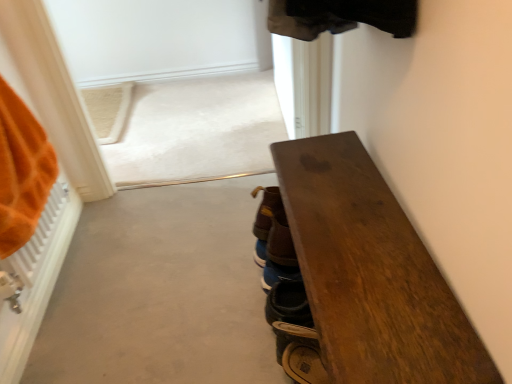
This screenshot has height=384, width=512. Identify the location of dark wood bench at right. (371, 272).

Measure the distance between dark wood bench at right and camera.

dark wood bench at right is 24.29 inches away from camera.

The height and width of the screenshot is (384, 512). What do you see at coordinates (274, 240) in the screenshot? I see `brown leather shoes at center, which is the second footwear in front-to-back order` at bounding box center [274, 240].

Image resolution: width=512 pixels, height=384 pixels. What are the coordinates of `dark wood bench at right` in the screenshot? It's located at (371, 272).

Who is taller, leather brown shoe at lower center, positioned as the first footwear in front-to-back order, or brown leather shoes at center, the second footwear viewed from the back?

brown leather shoes at center, the second footwear viewed from the back.

Is leather brown shoe at lower center, the third footwear positioned from the back, positioned far away from brown leather shoes at center, the second footwear viewed from the back?

Actually, leather brown shoe at lower center, the third footwear positioned from the back, and brown leather shoes at center, the second footwear viewed from the back, are a little close together.

Is leather brown shoe at lower center, the third footwear positioned from the back, outside of brown leather shoes at center, the second footwear viewed from the back?

Absolutely, leather brown shoe at lower center, the third footwear positioned from the back, is external to brown leather shoes at center, the second footwear viewed from the back.

Can leather brown shoe at lower center, positioned as the first footwear in front-to-back order, be found inside brown suede shoes at center, placed as the 1th footwear when sorted from back to front?

No, leather brown shoe at lower center, positioned as the first footwear in front-to-back order, is not surrounded by brown suede shoes at center, placed as the 1th footwear when sorted from back to front.

How far apart are brown suede shoes at center, the 3th footwear when ordered from front to back, and leather brown shoe at lower center, the third footwear positioned from the back?

brown suede shoes at center, the 3th footwear when ordered from front to back, and leather brown shoe at lower center, the third footwear positioned from the back, are 25.57 centimeters apart.

From the image's perspective, which one is positioned higher, brown suede shoes at center, the 3th footwear when ordered from front to back, or leather brown shoe at lower center, the third footwear positioned from the back?

brown suede shoes at center, the 3th footwear when ordered from front to back, is shown above in the image.

Looking at this image, considering the relative sizes of brown suede shoes at center, placed as the 1th footwear when sorted from back to front, and leather brown shoe at lower center, positioned as the first footwear in front-to-back order, in the image provided, is brown suede shoes at center, placed as the 1th footwear when sorted from back to front, bigger than leather brown shoe at lower center, positioned as the first footwear in front-to-back order,?

Yes.

Measure the distance between leather brown shoe at lower center, the third footwear positioned from the back, and brown suede shoes at center, the 3th footwear when ordered from front to back.

leather brown shoe at lower center, the third footwear positioned from the back, and brown suede shoes at center, the 3th footwear when ordered from front to back, are 10.07 inches apart.

Is leather brown shoe at lower center, positioned as the first footwear in front-to-back order, positioned far away from brown suede shoes at center, the 3th footwear when ordered from front to back?

No, leather brown shoe at lower center, positioned as the first footwear in front-to-back order, is in close proximity to brown suede shoes at center, the 3th footwear when ordered from front to back.

Which object is thinner, leather brown shoe at lower center, positioned as the first footwear in front-to-back order, or brown suede shoes at center, placed as the 1th footwear when sorted from back to front?

brown suede shoes at center, placed as the 1th footwear when sorted from back to front.

Considering the sizes of leather brown shoe at lower center, positioned as the first footwear in front-to-back order, and brown suede shoes at center, placed as the 1th footwear when sorted from back to front, in the image, is leather brown shoe at lower center, positioned as the first footwear in front-to-back order, bigger or smaller than brown suede shoes at center, placed as the 1th footwear when sorted from back to front,?

Clearly, leather brown shoe at lower center, positioned as the first footwear in front-to-back order, is smaller in size than brown suede shoes at center, placed as the 1th footwear when sorted from back to front.

Which is less distant, (x=271, y=196) or (x=260, y=214)?

Clearly, point (x=271, y=196) is closer to the camera than point (x=260, y=214).

Is brown suede shoes at center, placed as the 1th footwear when sorted from back to front, next to brown leather shoes at center, the second footwear viewed from the back, and touching it?

Yes, brown suede shoes at center, placed as the 1th footwear when sorted from back to front, is in contact with brown leather shoes at center, the second footwear viewed from the back.

Can you confirm if brown suede shoes at center, the 3th footwear when ordered from front to back, is shorter than brown leather shoes at center, which is the second footwear in front-to-back order?

Yes.

Is leather brown shoe at lower center, the third footwear positioned from the back, turned away from dark wood bench at right?

Yes, leather brown shoe at lower center, the third footwear positioned from the back,'s orientation is away from dark wood bench at right.

From a real-world perspective, which object rests below the other?

dark wood bench at right.

Consider the image. Who is taller, leather brown shoe at lower center, the third footwear positioned from the back, or dark wood bench at right?

dark wood bench at right.

Is point (288, 334) less distant than point (285, 168)?

Yes, it is in front of point (285, 168).

From a real-world perspective, is dark wood bench at right positioned over brown suede shoes at center, the 3th footwear when ordered from front to back, based on gravity?

No, from a real-world perspective, dark wood bench at right is not over brown suede shoes at center, the 3th footwear when ordered from front to back

Is dark wood bench at right at the right side of brown suede shoes at center, placed as the 1th footwear when sorted from back to front?

Yes, dark wood bench at right is to the right of brown suede shoes at center, placed as the 1th footwear when sorted from back to front.

Is there a large distance between dark wood bench at right and brown suede shoes at center, placed as the 1th footwear when sorted from back to front?

dark wood bench at right is near brown suede shoes at center, placed as the 1th footwear when sorted from back to front, not far away.

Is dark wood bench at right oriented away from brown suede shoes at center, placed as the 1th footwear when sorted from back to front?

No, dark wood bench at right's orientation is not away from brown suede shoes at center, placed as the 1th footwear when sorted from back to front.

Can you confirm if brown suede shoes at center, placed as the 1th footwear when sorted from back to front, is shorter than dark wood bench at right?

Yes.

How much distance is there between brown suede shoes at center, placed as the 1th footwear when sorted from back to front, and dark wood bench at right?

12.44 inches.

From a real-world perspective, which object rests below the other?

dark wood bench at right.

At what (x,y) coordinates should I click in order to perform the action: click on the 1st footwear to the left when counting from the leather brown shoe at lower center, the third footwear positioned from the back. Please return your answer as a coordinate pair (x, y). The image size is (512, 384). Looking at the image, I should click on (274, 240).

Identify the location of footwear that is under the brown suede shoes at center, placed as the 1th footwear when sorted from back to front (from a real-world perspective). (295, 333).

Considering their positions, is brown leather shoes at center, which is the second footwear in front-to-back order, positioned closer to dark wood bench at right than leather brown shoe at lower center, the third footwear positioned from the back?

leather brown shoe at lower center, the third footwear positioned from the back.

Considering their positions, is brown suede shoes at center, placed as the 1th footwear when sorted from back to front, positioned further to dark wood bench at right than brown leather shoes at center, the second footwear viewed from the back?

brown suede shoes at center, placed as the 1th footwear when sorted from back to front.

When comparing their distances from leather brown shoe at lower center, positioned as the first footwear in front-to-back order, does brown suede shoes at center, placed as the 1th footwear when sorted from back to front, or brown leather shoes at center, which is the second footwear in front-to-back order, seem closer?

brown leather shoes at center, which is the second footwear in front-to-back order.

Estimate the real-world distances between objects in this image. Which object is further from dark wood bench at right, leather brown shoe at lower center, positioned as the first footwear in front-to-back order, or brown suede shoes at center, placed as the 1th footwear when sorted from back to front?

Among the two, brown suede shoes at center, placed as the 1th footwear when sorted from back to front, is located further to dark wood bench at right.

When comparing their distances from dark wood bench at right, does brown leather shoes at center, which is the second footwear in front-to-back order, or brown suede shoes at center, placed as the 1th footwear when sorted from back to front, seem closer?

brown leather shoes at center, which is the second footwear in front-to-back order, is positioned closer to the anchor dark wood bench at right.

Estimate the real-world distances between objects in this image. Which object is further from brown suede shoes at center, the 3th footwear when ordered from front to back, dark wood bench at right or brown leather shoes at center, the second footwear viewed from the back?

dark wood bench at right is further to brown suede shoes at center, the 3th footwear when ordered from front to back.

Looking at the image, which one is located closer to brown suede shoes at center, placed as the 1th footwear when sorted from back to front, leather brown shoe at lower center, the third footwear positioned from the back, or brown leather shoes at center, the second footwear viewed from the back?

brown leather shoes at center, the second footwear viewed from the back.

Estimate the real-world distances between objects in this image. Which object is further from brown leather shoes at center, which is the second footwear in front-to-back order, dark wood bench at right or brown suede shoes at center, placed as the 1th footwear when sorted from back to front?

Among the two, dark wood bench at right is located further to brown leather shoes at center, which is the second footwear in front-to-back order.

At what (x,y) coordinates should I click in order to perform the action: click on footwear positioned between dark wood bench at right and brown leather shoes at center, which is the second footwear in front-to-back order, from near to far. Please return your answer as a coordinate pair (x, y). This screenshot has width=512, height=384. Looking at the image, I should click on click(x=295, y=333).

Locate an element on the screen. The height and width of the screenshot is (384, 512). footwear between leather brown shoe at lower center, the third footwear positioned from the back, and brown suede shoes at center, the 3th footwear when ordered from front to back, in the front-back direction is located at coordinates (274, 240).